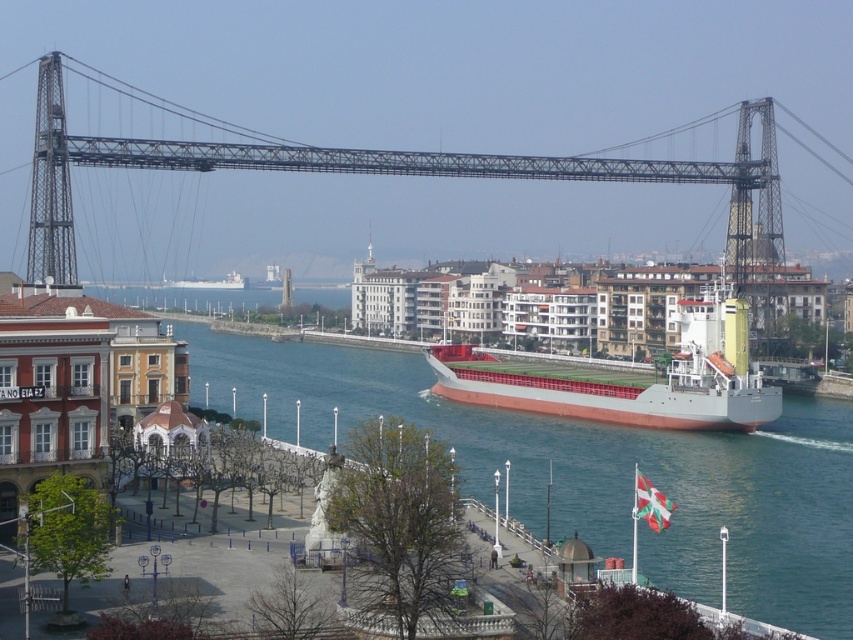
Question: Considering the relative positions of metallic suspension bridge at center and red matte cargo ship at center in the image provided, where is metallic suspension bridge at center located with respect to red matte cargo ship at center?

Choices:
 (A) above
 (B) below

Answer: (A)

Question: Among these objects, which one is farthest from the camera?

Choices:
 (A) metallic suspension bridge at center
 (B) red matte cargo ship at center

Answer: (B)

Question: Which point is closer to the camera?

Choices:
 (A) red matte cargo ship at center
 (B) metallic suspension bridge at center

Answer: (B)

Question: Is metallic suspension bridge at center further to camera compared to red matte cargo ship at center?

Choices:
 (A) no
 (B) yes

Answer: (A)

Question: Does metallic suspension bridge at center appear on the right side of red matte cargo ship at center?

Choices:
 (A) no
 (B) yes

Answer: (A)